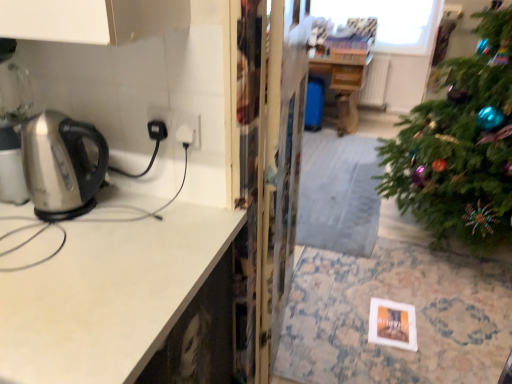
Question: From a real-world perspective, is metallic stainless steel kettle at left physically below satin white countertop at left?

Choices:
 (A) no
 (B) yes

Answer: (B)

Question: Considering the relative positions of metallic stainless steel kettle at left and satin white countertop at left in the image provided, is metallic stainless steel kettle at left behind satin white countertop at left?

Choices:
 (A) yes
 (B) no

Answer: (A)

Question: From a real-world perspective, is metallic stainless steel kettle at left physically above satin white countertop at left?

Choices:
 (A) yes
 (B) no

Answer: (B)

Question: Is metallic stainless steel kettle at left to the right of satin white countertop at left from the viewer's perspective?

Choices:
 (A) yes
 (B) no

Answer: (A)

Question: Can we say metallic stainless steel kettle at left lies outside satin white countertop at left?

Choices:
 (A) yes
 (B) no

Answer: (A)

Question: Looking at the image, does wooden table at center seem bigger or smaller compared to transparent plastic screen door at center?

Choices:
 (A) small
 (B) big

Answer: (B)

Question: Do you think wooden table at center is within transparent plastic screen door at center, or outside of it?

Choices:
 (A) inside
 (B) outside

Answer: (B)

Question: In the image, is wooden table at center positioned in front of or behind transparent plastic screen door at center?

Choices:
 (A) front
 (B) behind

Answer: (B)

Question: Considering the relative positions of wooden table at center and transparent plastic screen door at center in the image provided, is wooden table at center to the left or to the right of transparent plastic screen door at center?

Choices:
 (A) right
 (B) left

Answer: (A)

Question: In terms of height, does satin white countertop at left look taller or shorter compared to transparent plastic screen door at center?

Choices:
 (A) short
 (B) tall

Answer: (A)

Question: Is satin white countertop at left in front of or behind transparent plastic screen door at center in the image?

Choices:
 (A) front
 (B) behind

Answer: (A)

Question: Considering the positions of point (121, 357) and point (247, 137), is point (121, 357) closer or farther from the camera than point (247, 137)?

Choices:
 (A) farther
 (B) closer

Answer: (B)

Question: In terms of width, does satin white countertop at left look wider or thinner when compared to transparent plastic screen door at center?

Choices:
 (A) wide
 (B) thin

Answer: (A)

Question: Would you say metallic stainless steel kettle at left is inside or outside satin white countertop at left?

Choices:
 (A) outside
 (B) inside

Answer: (A)

Question: From a real-world perspective, is metallic stainless steel kettle at left physically located above or below satin white countertop at left?

Choices:
 (A) below
 (B) above

Answer: (A)